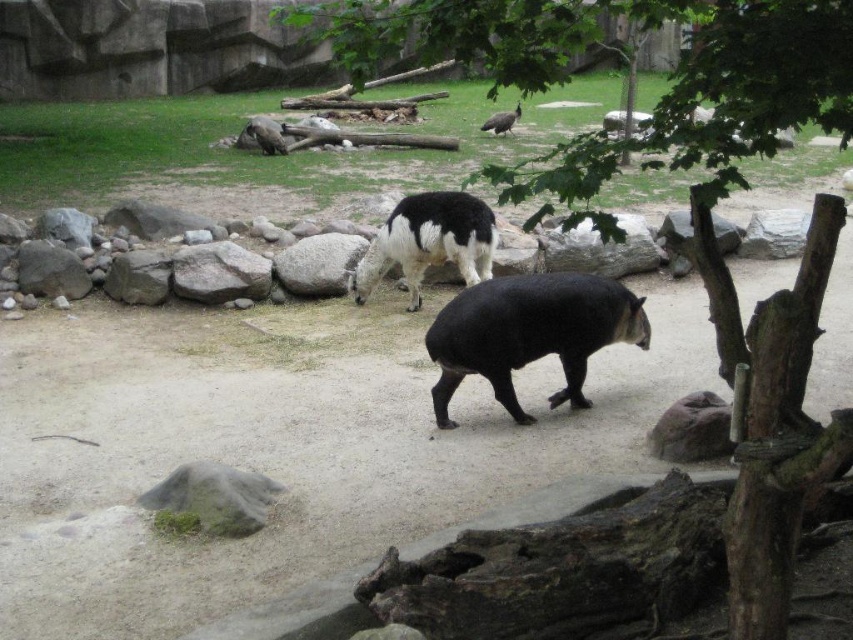
You are a zookeeper planning to place a new feeding station in the enclosure. The feeding station must be positioned at point (529, 333). Based on the scene description, which animal is closest to this point?

The point (529, 333) corresponds to the black smooth tapir at center, so the black smooth tapir at center is closest to this point.

You are a zookeeper planning to feed the animals. You have a bag of feed that you want to place between the black smooth tapir at center and the brown fur bird at upper center. Based on their positions, where should you place the feed so both animals can easily reach it?

The black smooth tapir at center is below the brown fur bird at upper center, so placing the feed between them would require positioning it in a spot that is above the tapir but below the bird. However, since the tapir is at the center and the bird is at the upper center, the optimal position might be slightly above the tapir but within the tapir s reachable area, as the bird can likely come down to that level.

You are a zookeeper trying to locate the white woolen llama at center and the white woolen llama at upper center. Which one is closer to you?

The white woolen llama at center is closer to the viewer than the white woolen llama at upper center.